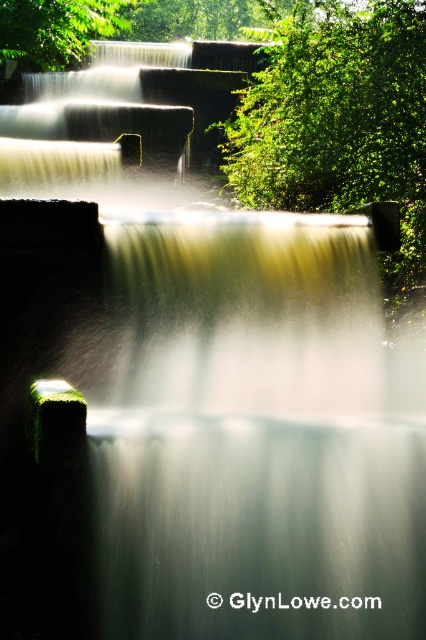
You are standing at the base of the waterfall and want to take a photo of the green leafy tree at upper center. If your camera has a zoom lens that can focus on objects at a specific coordinate, what coordinate should you aim for?

You should aim for the coordinate point at (339, 116) to capture the green leafy tree at upper center in your photo.